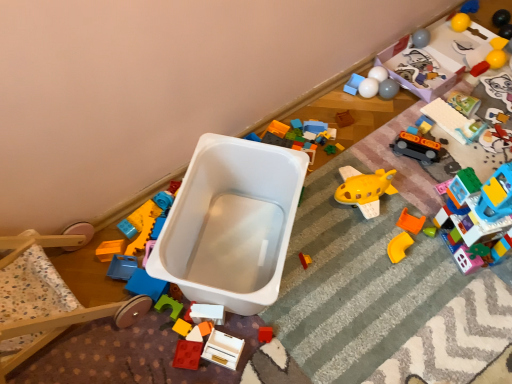
Locate an element on the screen. vacant space behind rubberized plastic block at center, the sixteenth toy from the right is located at coordinates (210, 265).